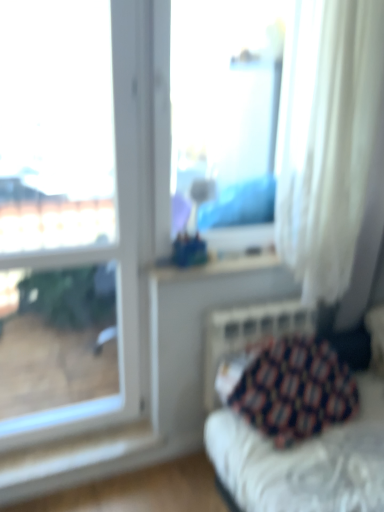
Question: Looking at the image, does transparent glass window at upper left, which is the first window from left to right, seem bigger or smaller compared to patterned fabric cushion at lower right?

Choices:
 (A) small
 (B) big

Answer: (A)

Question: From a real-world perspective, relative to patterned fabric cushion at lower right, is transparent glass window at upper left, which is the first window from left to right, vertically above or below?

Choices:
 (A) above
 (B) below

Answer: (A)

Question: Estimate the real-world distances between objects in this image. Which object is farther from the transparent glass vase at center, marked as the second window in a left-to-right arrangement?

Choices:
 (A) transparent glass window at upper left, which is the first window from left to right
 (B) patterned fabric cushion at lower right
 (C) white sheer curtain at right
 (D) metallic silver radiator at lower right

Answer: (B)

Question: Which of these objects is positioned closest to the metallic silver radiator at lower right?

Choices:
 (A) transparent glass window at upper left, which is the first window from left to right
 (B) patterned fabric cushion at lower right
 (C) transparent glass vase at center, which is the 1th window in right-to-left order
 (D) white sheer curtain at right

Answer: (B)